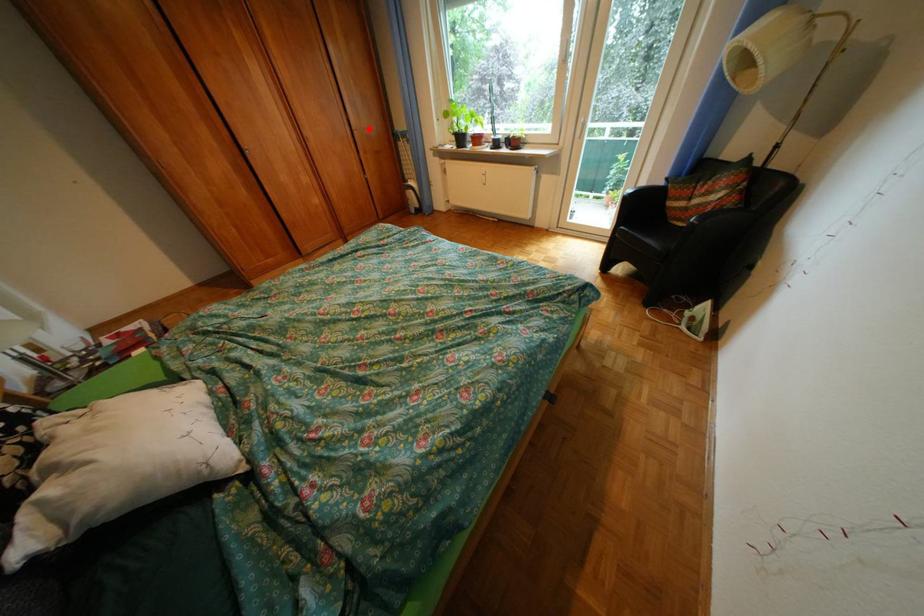
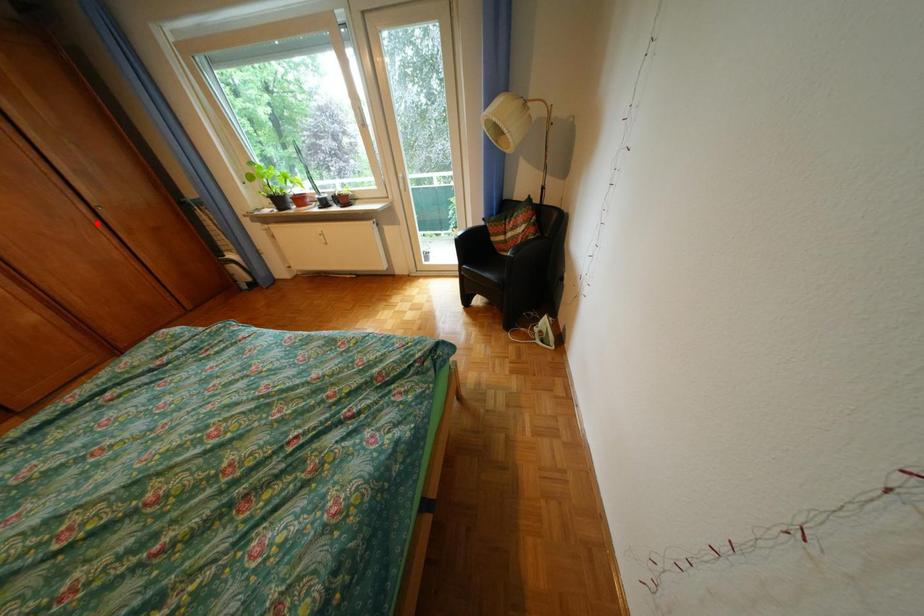
I am providing you with two images of the same scene from different viewpoints. A red point is marked on the first image and another point is marked on the second image. Are the points marked in image1 and image2 representing the same 3D position?

No